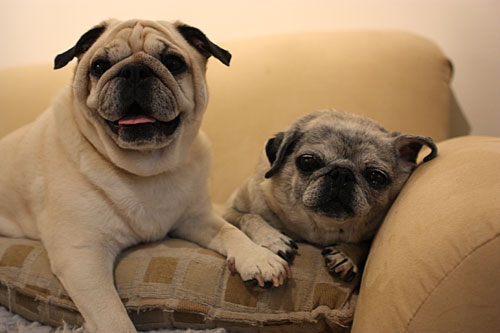
Identify the location of pillow. (181, 284).